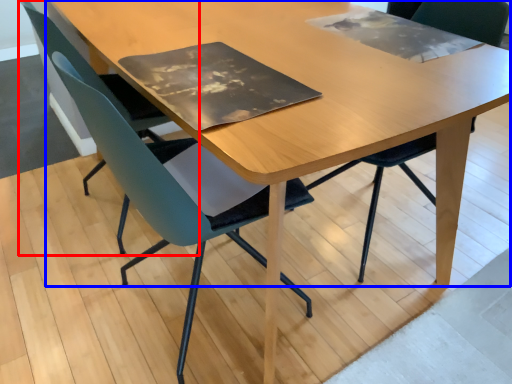
Question: Which object appears closest to the camera in this image, chair (highlighted by a red box) or table (highlighted by a blue box)?

Choices:
 (A) chair
 (B) table

Answer: (B)